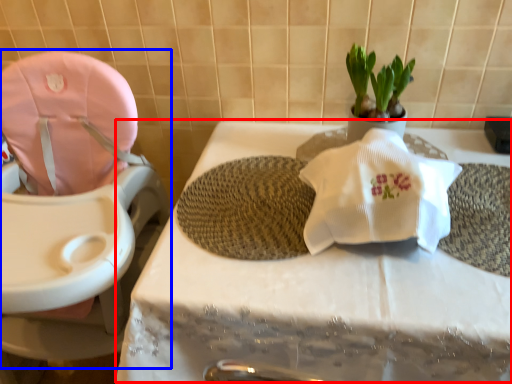
Question: Among these objects, which one is nearest to the camera, table (highlighted by a red box) or baby carriage (highlighted by a blue box)?

Choices:
 (A) table
 (B) baby carriage

Answer: (B)